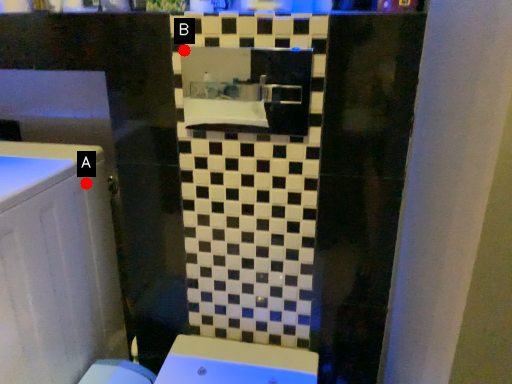
Question: Two points are circled on the image, labeled by A and B beside each circle. Which point is farther from the camera taking this photo?

Choices:
 (A) A is further
 (B) B is further

Answer: (B)